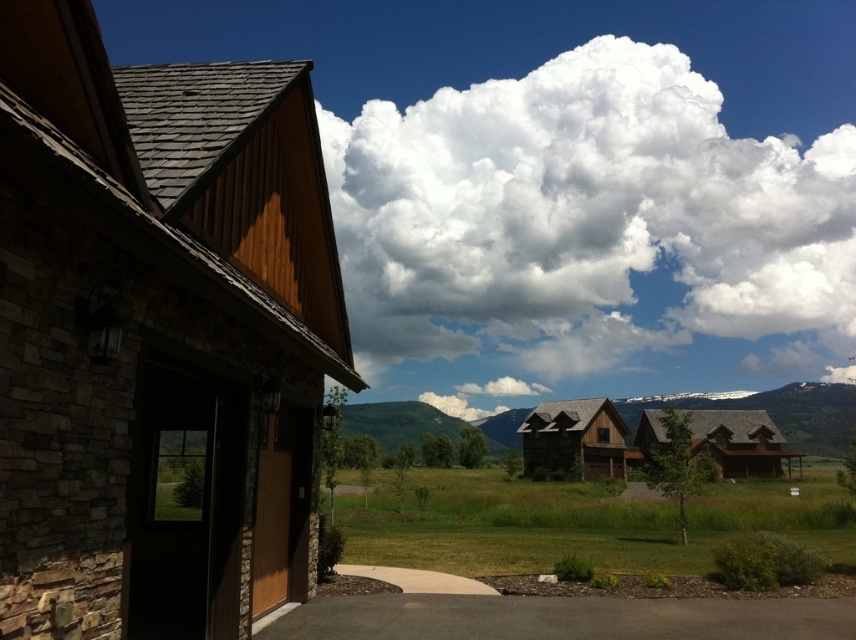
You are standing in the rural landscape scene and want to place a small garden between the two points, point [486,428] and point [428,577]. Which point should the garden be closer to in order to appear closer to the camera?

The garden should be closer to point [486,428] because it is further to the camera than point [428,577], so placing it near that point would make the garden appear closer to the viewer.

You are standing at the point marked as point (x=797, y=413) in the image. What structure are you currently standing on?

You are standing on the wooden cabin at center because the point (x=797, y=413) is located on it.

You are standing at the entrance of the stone and wood building with the dark wooden door. You want to walk to the smooth concrete driveway at lower center but need to avoid the white fluffy cloud at upper center. Which direction should you walk to reach the driveway without going near the cloud?

The white fluffy cloud at upper center is to the right of the smooth concrete driveway at lower center, so you should walk to the left of the driveway to avoid the cloud.